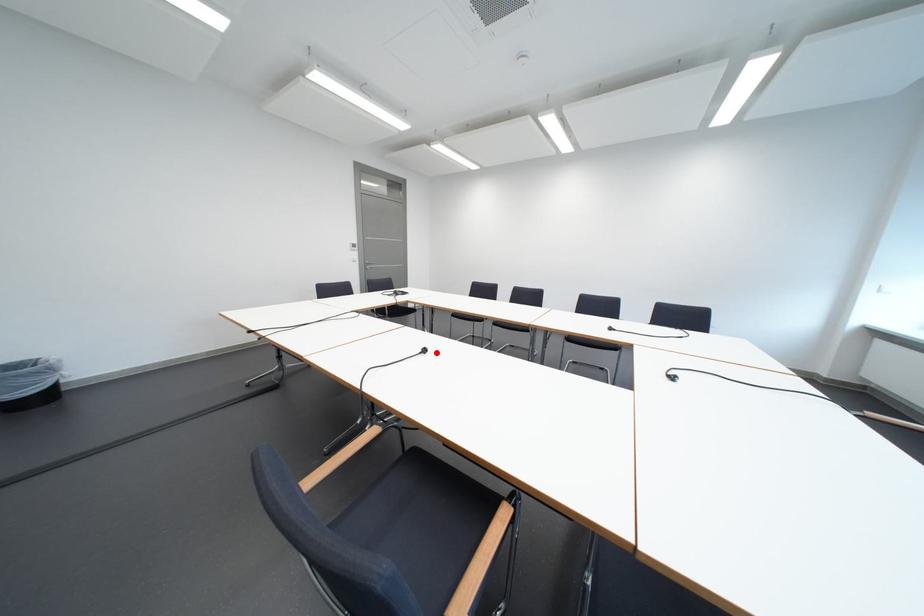
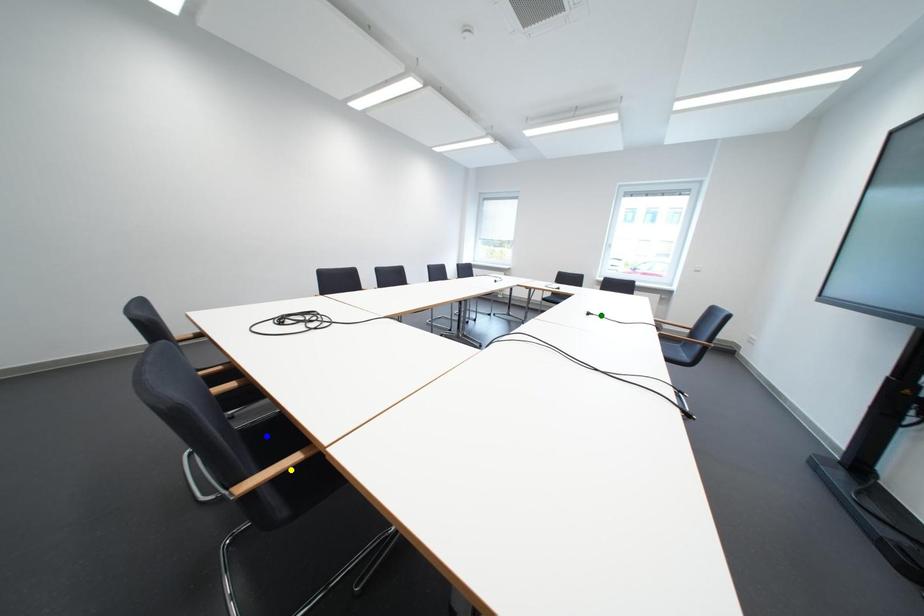
Question: I am providing you with two images of the same scene from different viewpoints. A red point is marked on the first image. You are given multiple points on the second image. Which mark in image 2 goes with the point in image 1?

Choices:
 (A) blue point
 (B) yellow point
 (C) green point

Answer: (C)